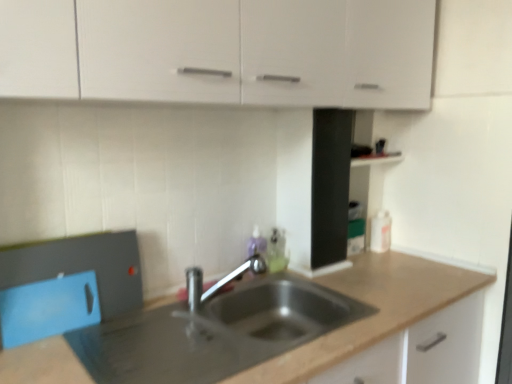
Identify the location of vacant space situated on the left part of polished chrome tap at center. (166, 318).